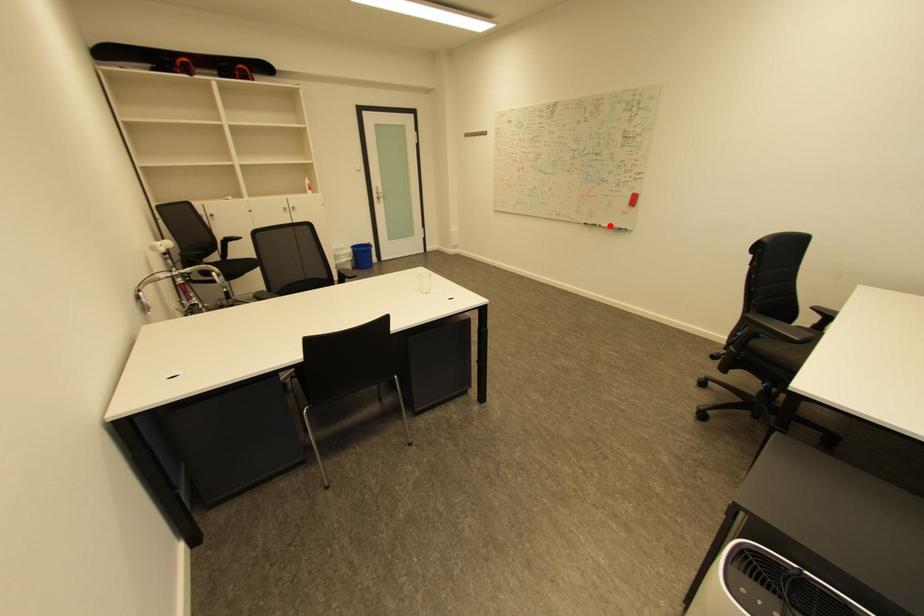
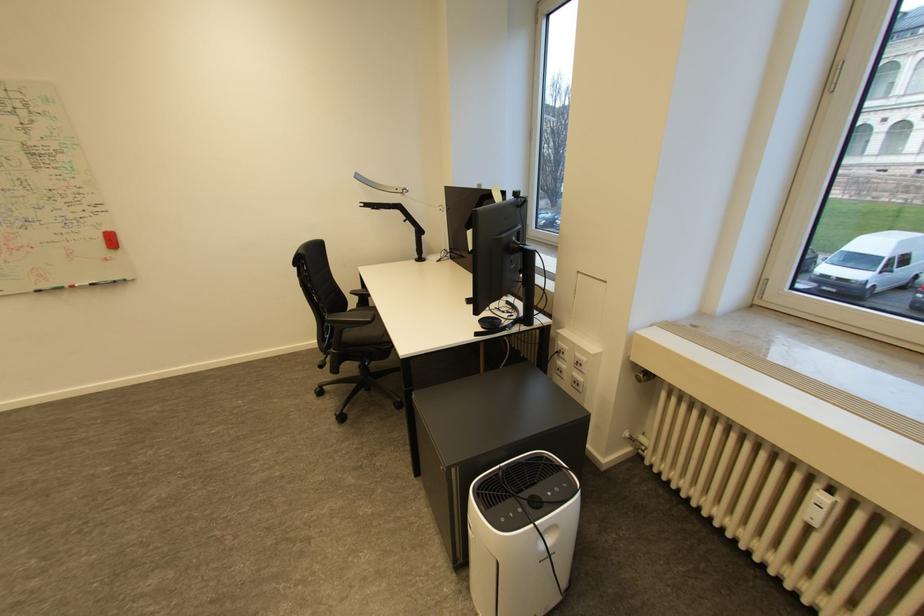
Where in the second image is the point corresponding to the highlighted location from the first image?

(83, 286)